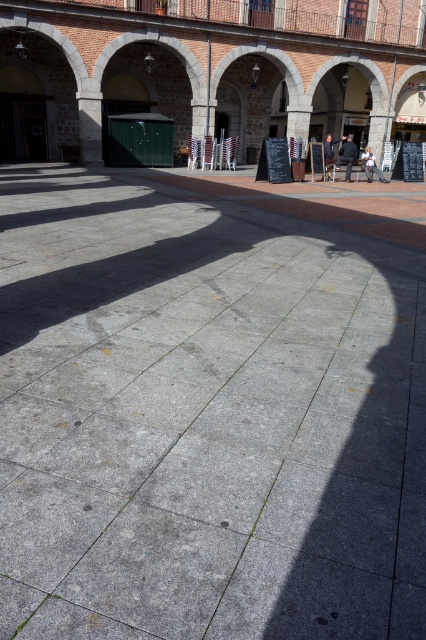
You are standing at the center of the plaza and see two points marked on the ground, point (348, 148) and point (368, 173). Which point is closer to you?

Point (348, 148) is in front of point (368, 173), so it is closer to you.